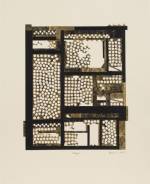
Find the location of a particular element. This screenshot has width=150, height=184. protruding corner beam is located at coordinates (29, 24), (126, 28).